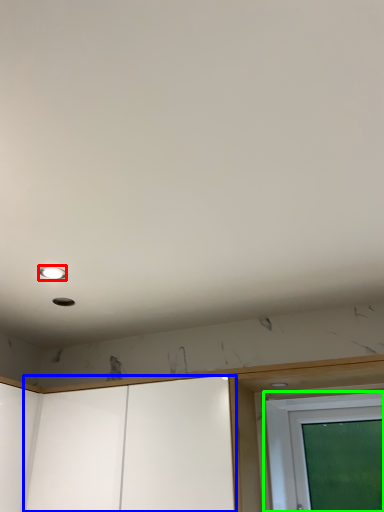
Question: Which object is the closest to the droplight (highlighted by a red box)? Choose among these: screen door (highlighted by a blue box) or screen door (highlighted by a green box).

Choices:
 (A) screen door
 (B) screen door

Answer: (A)